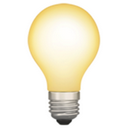
Where is `lamp requirement`? The height and width of the screenshot is (128, 128). lamp requirement is located at coordinates (65, 85).